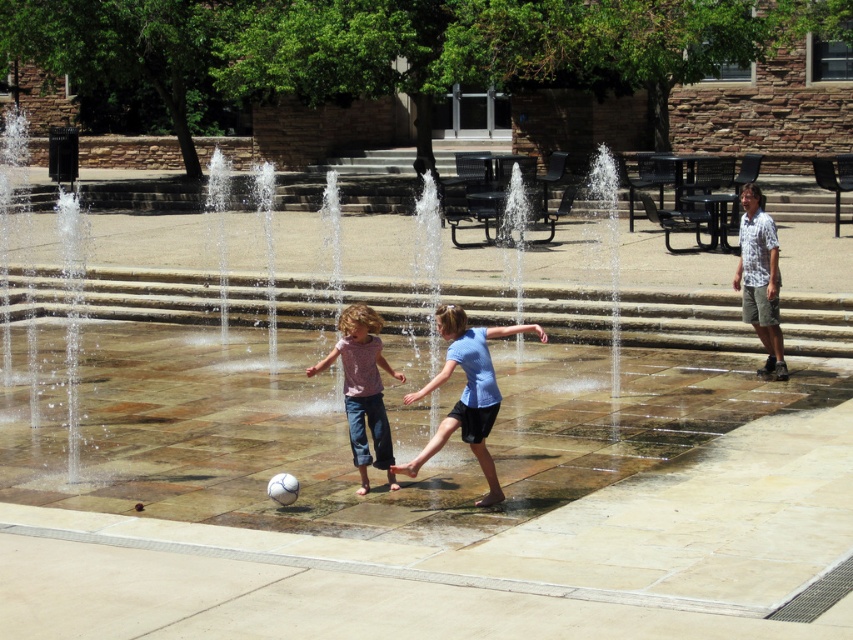
Question: Is blue matte shirt at center wider than denim pants at center?

Choices:
 (A) yes
 (B) no

Answer: (A)

Question: Which point is closer to the camera taking this photo?

Choices:
 (A) (347, 320)
 (B) (476, 422)

Answer: (B)

Question: Does blue matte shirt at center lie behind denim pants at center?

Choices:
 (A) yes
 (B) no

Answer: (B)

Question: Which point is farther from the camera taking this photo?

Choices:
 (A) (378, 328)
 (B) (483, 387)

Answer: (A)

Question: Is blue matte shirt at center behind denim pants at center?

Choices:
 (A) yes
 (B) no

Answer: (B)